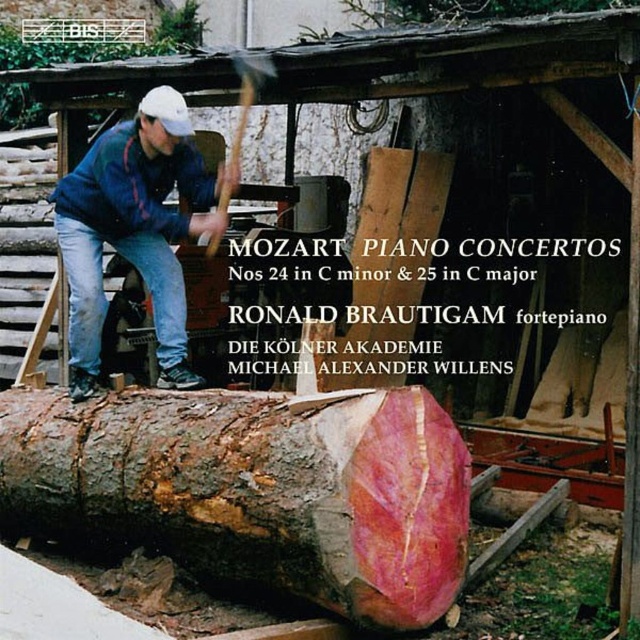
Question: Can you confirm if smooth reddish-brown log at lower center is positioned below blue denim jeans at left?

Choices:
 (A) yes
 (B) no

Answer: (A)

Question: Observing the image, what is the correct spatial positioning of smooth reddish-brown log at lower center in reference to blue denim jeans at left?

Choices:
 (A) above
 (B) below

Answer: (B)

Question: Among these objects, which one is farthest from the camera?

Choices:
 (A) blue denim jeans at left
 (B) smooth reddish-brown log at lower center

Answer: (A)

Question: Does smooth reddish-brown log at lower center have a smaller size compared to blue denim jeans at left?

Choices:
 (A) yes
 (B) no

Answer: (B)

Question: Which point is closer to the camera taking this photo?

Choices:
 (A) (77, 433)
 (B) (173, 109)

Answer: (B)